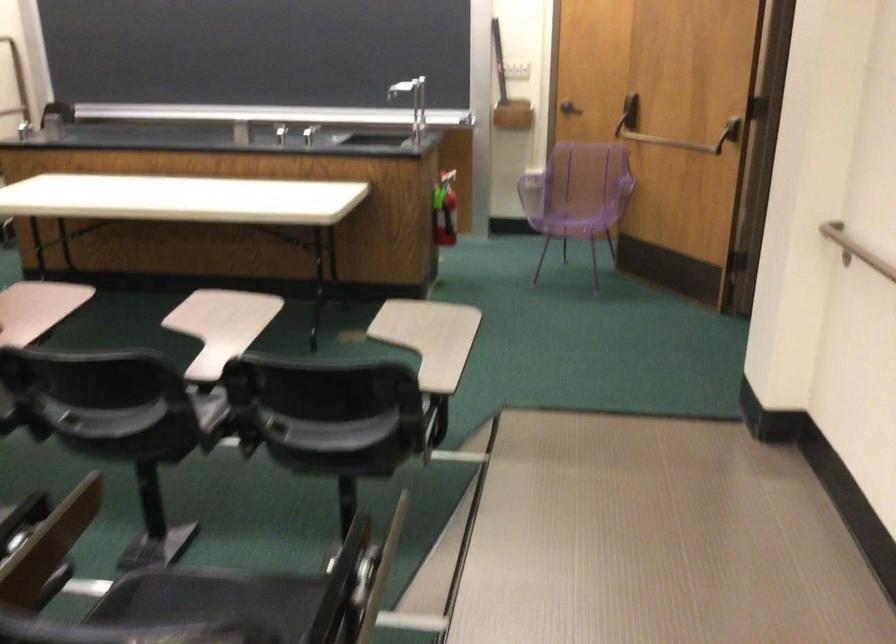
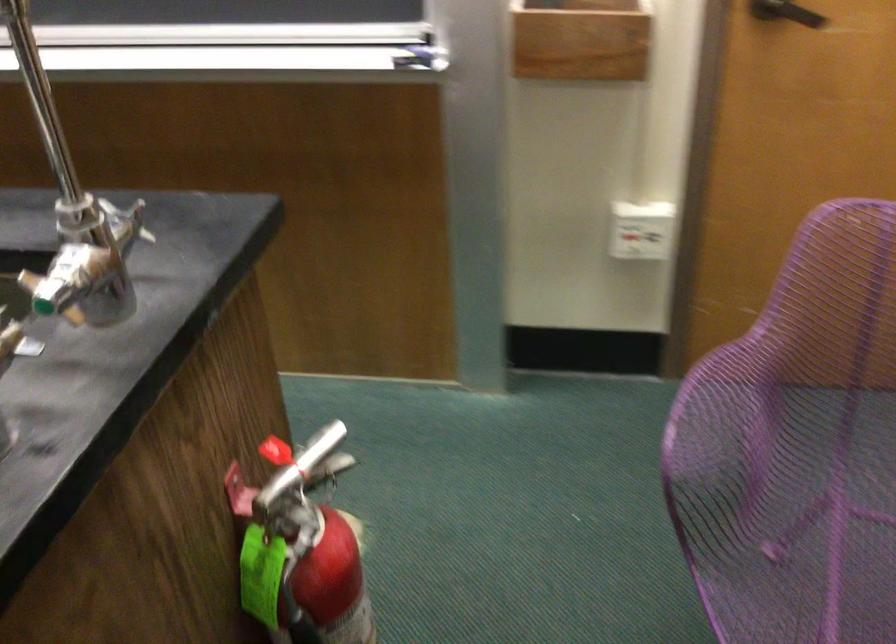
Question: In a continuous first-person perspective shot, in which direction is the camera moving?

Choices:
 (A) Left
 (B) Right
 (C) Forward
 (D) Backward

Answer: (C)